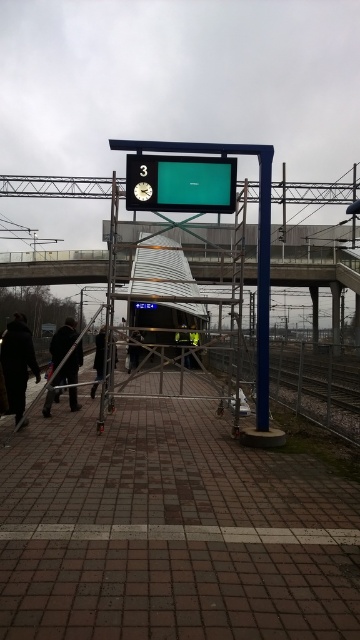
You are a tailor standing on the train station platform. You see a dark brown leather coat at lower left and a dark brown leather jacket at lower left. Can you determine if there is enough space between them to place a 36 inch wide tailor box?

The dark brown leather coat at lower left is 35.60 inches from the dark brown leather jacket at lower left. Since the distance between them is less than 36 inches, the tailor box cannot fit between them.

You are standing on the train station platform and see two points marked on the ground. The first point is at coordinate point [61,340] and the second is at point [185,356]. Which point is closer to you?

Point [61,340] is closer to you because it is further to the viewer than point [185,356].

You are a commuter waiting on the platform and notice both the dark gray uniform at center and the black glossy clock at center. Which object is bigger in size?

The dark gray uniform at center is larger in size compared to the black glossy clock at center.